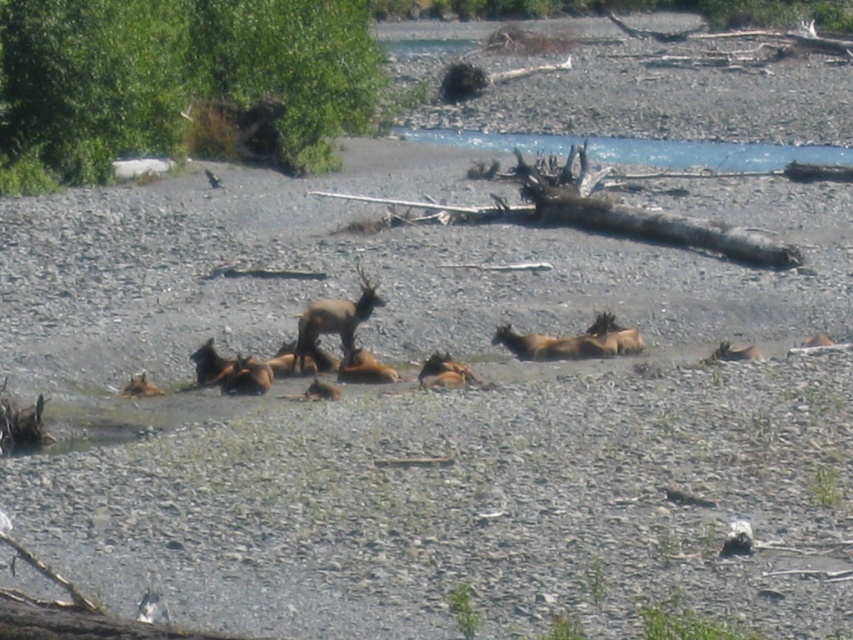
You are an ecologist studying the elk habitat. You need to place a camera trap to monitor the elk without disturbing them. The camera has a field of view that can cover an area up to 10 meters in radius. Given the green leafy bush at upper left is located at coordinates point 0.133, 0.217, where should you place the camera to ensure it captures the elk while avoiding the bush?

Place the camera at least 10 meters away from the green leafy bush at upper left located at point (x=184, y=84) to ensure the elk are captured without the bush obstructing the view.

Consider the image. You are an ecologist observing the elk in their natural habitat. You notice the green leafy bush at upper left and the brown furry deer at center. Which object is wider?

The green leafy bush at upper left is wider than the brown furry deer at center because its width surpasses that of the brown furry deer at center.